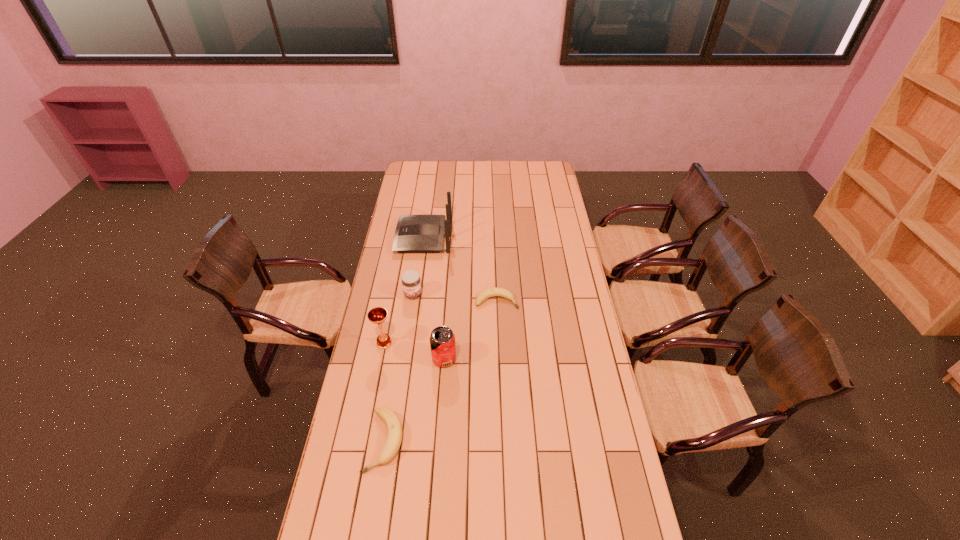
This screenshot has width=960, height=540. What are the coordinates of `the second shortest object` in the screenshot? It's located at (394, 428).

Image resolution: width=960 pixels, height=540 pixels. What are the coordinates of `the taller banana` in the screenshot? It's located at (394, 428).

Identify the location of the shorter banana. (491, 292).

Find the location of a particular element. The height and width of the screenshot is (540, 960). the shortest object is located at coordinates (491, 292).

This screenshot has height=540, width=960. Find the location of `jam`. jam is located at coordinates (411, 282).

Identify the location of the farthest object. (414, 233).

I want to click on the tallest object, so click(414, 233).

You are a GUI agent. You are given a task and a screenshot of the screen. Output one action in this format:
    pyautogui.click(x=<x>, y=<y>)
    Task: Click on the chalice
    This screenshot has width=960, height=540.
    Given the screenshot: What is the action you would take?
    pyautogui.click(x=377, y=315)

In order to click on soda can in this screenshot , I will do `click(442, 339)`.

Find the location of a particular element. The height and width of the screenshot is (540, 960). free space located 0.050m at the stem of the second shortest object is located at coordinates (376, 491).